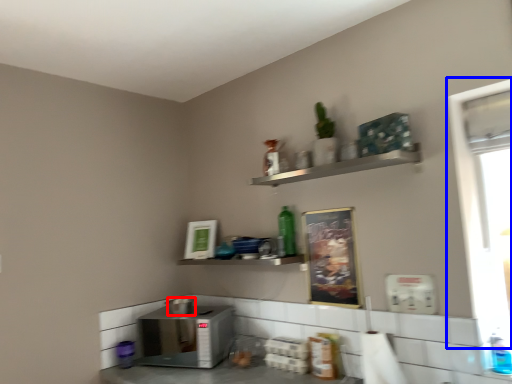
Question: Among these objects, which one is nearest to the camera, appliance (highlighted by a red box) or window screen (highlighted by a blue box)?

Choices:
 (A) appliance
 (B) window screen

Answer: (B)